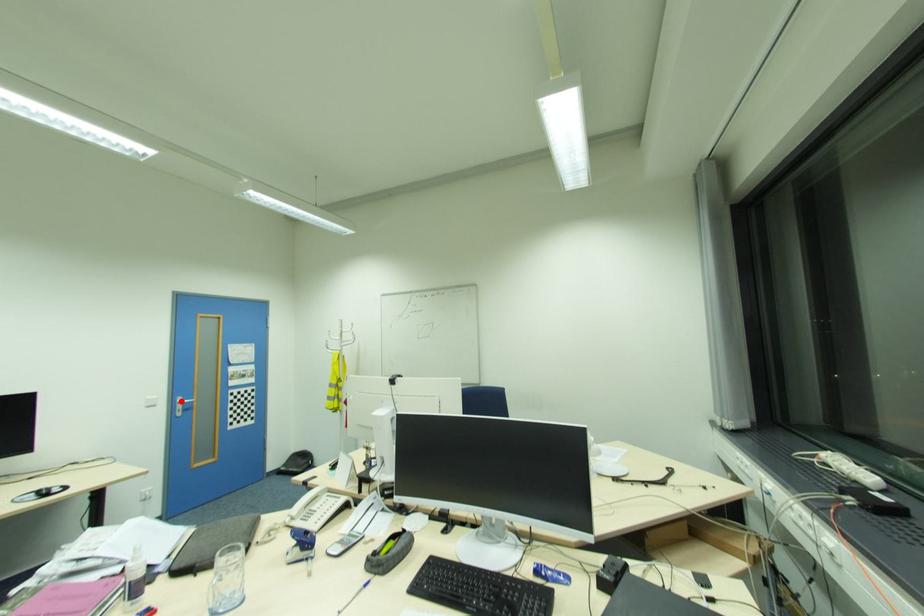
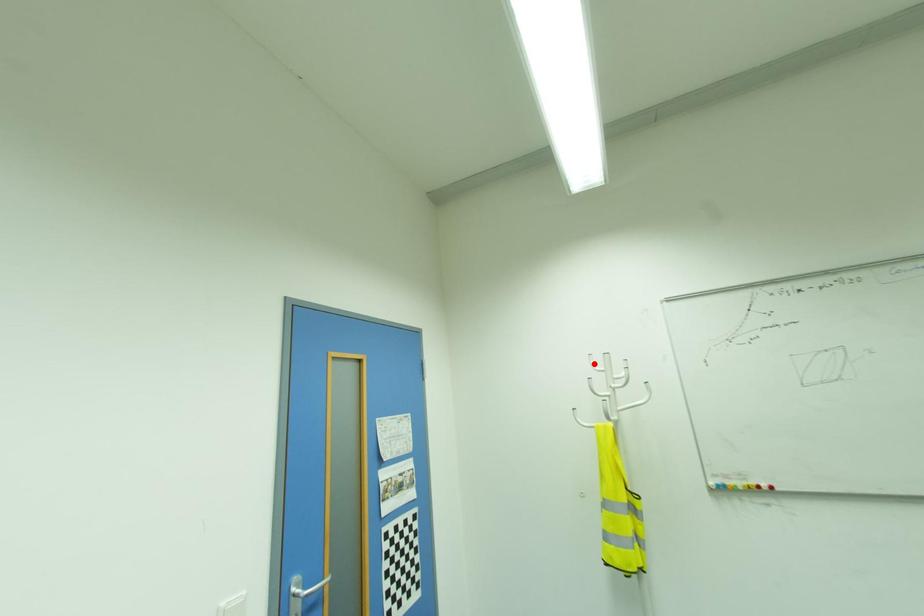
I am providing you with two images of the same scene from different viewpoints. A red point is marked on the first image and another point is marked on the second image. Is the marked point in image1 the same physical position as the marked point in image2?

No